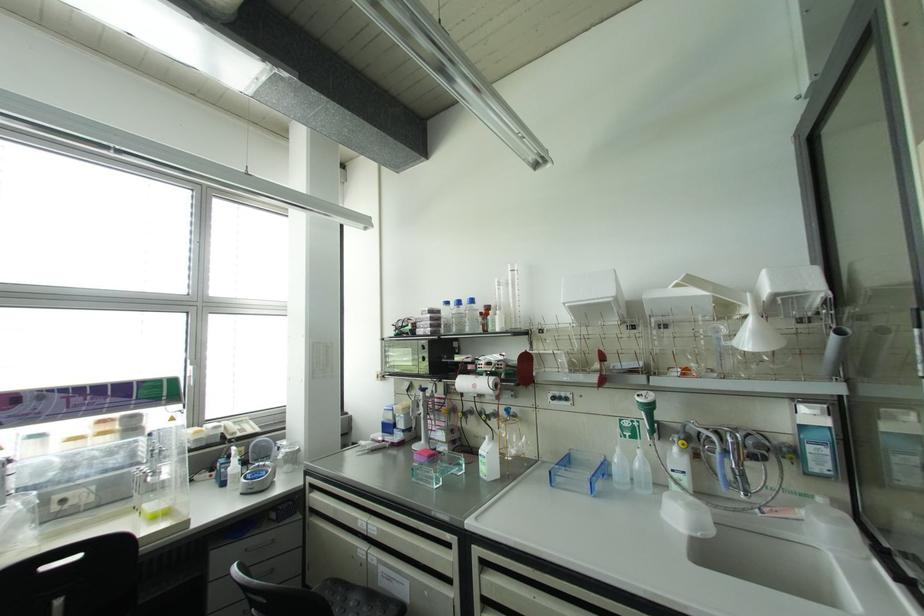
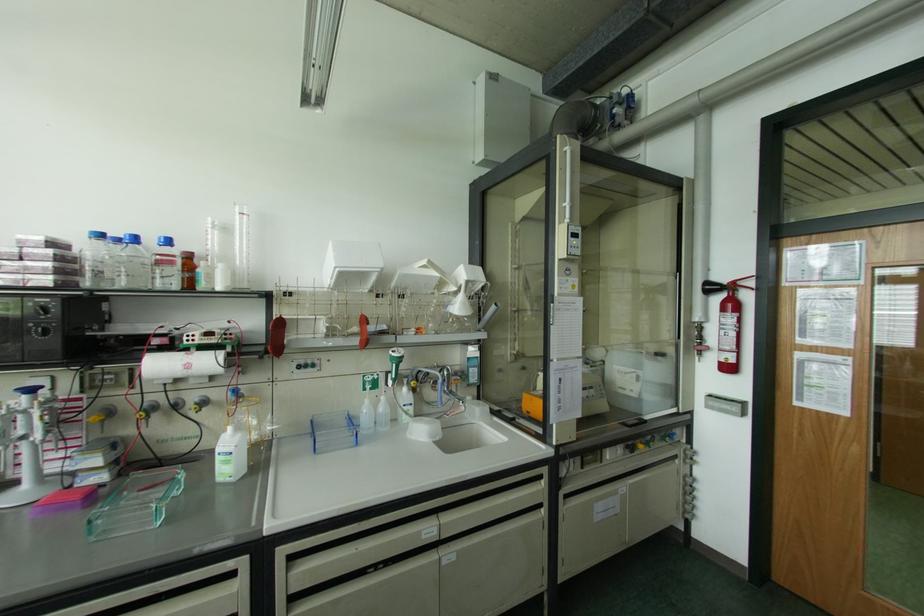
Question: I am providing you with two images of the same scene from different viewpoints. Please identify which objects are invisible in image2.

Choices:
 (A) clear squirt bottle
 (B) paper towel roll
 (C) blue control knob
 (D) none of these

Answer: (D)